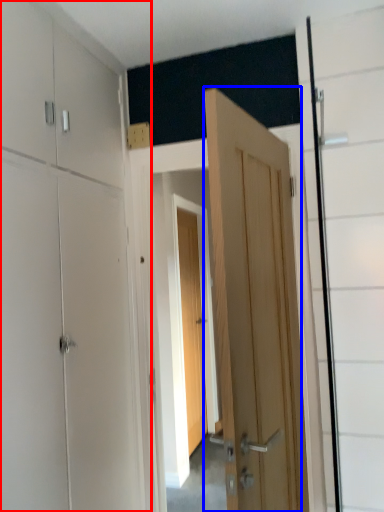
Question: Which object appears closest to the camera in this image, dresser (highlighted by a red box) or door (highlighted by a blue box)?

Choices:
 (A) dresser
 (B) door

Answer: (A)